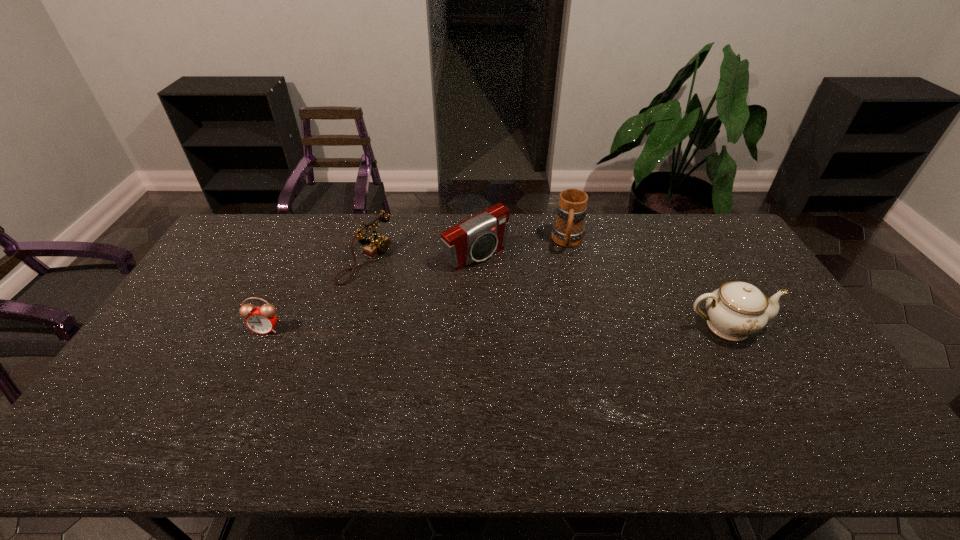
Where is `free space between the telephone and the alarm clock`? The height and width of the screenshot is (540, 960). free space between the telephone and the alarm clock is located at coordinates (316, 295).

Image resolution: width=960 pixels, height=540 pixels. What are the coordinates of `the closest object relative to the third object from right to left` in the screenshot? It's located at (568, 230).

Select which object appears as the closest to the alarm clock. Please provide its 2D coordinates. Your answer should be formatted as a tuple, i.e. [(x, y)], where the tuple contains the x and y coordinates of a point satisfying the conditions above.

[(377, 244)]

Where is `vacant space that satisfies the following two spatial constraints: 1. on the front side of the rightmost object; 2. at the spout of the camera`? vacant space that satisfies the following two spatial constraints: 1. on the front side of the rightmost object; 2. at the spout of the camera is located at coordinates (475, 326).

You are a GUI agent. You are given a task and a screenshot of the screen. Output one action in this format:
    pyautogui.click(x=<x>, y=<y>)
    Task: Click on the vacant area in the image that satisfies the following two spatial constraints: 1. on the back side of the mug; 2. on the right side of the third object from left to right
    Image resolution: width=960 pixels, height=540 pixels.
    Given the screenshot: What is the action you would take?
    pyautogui.click(x=476, y=242)